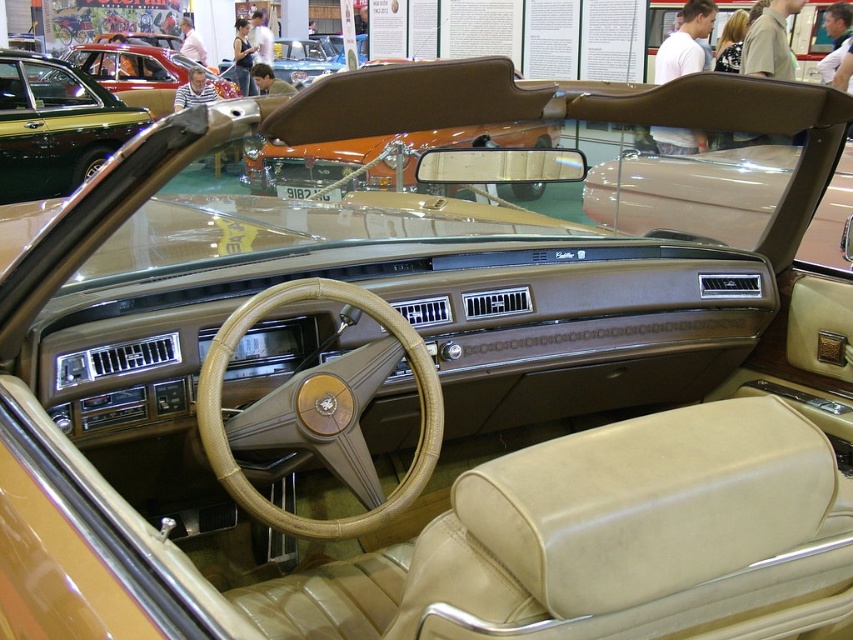
You are a mechanic working on a vintage car. You need to reach a tool located near the matte brown convertible top at center from your current position near the leather textured steering wheel at center. The tool is 1.2 meters long. Can you safely extend the tool without it hitting any part of the car? Please consider the distance between the steering wheel and the convertible top.

The distance between the leather textured steering wheel at center and the matte brown convertible top at center is 5.10 meters. Since the tool is only 1.2 meters long, there is ample space to safely extend it without hitting any part of the car.

You are sitting in the vintage car and want to locate the point at coordinates point (225, 433). Where exactly is this point located?

The point (225, 433) is located on the leather textured steering wheel at center.